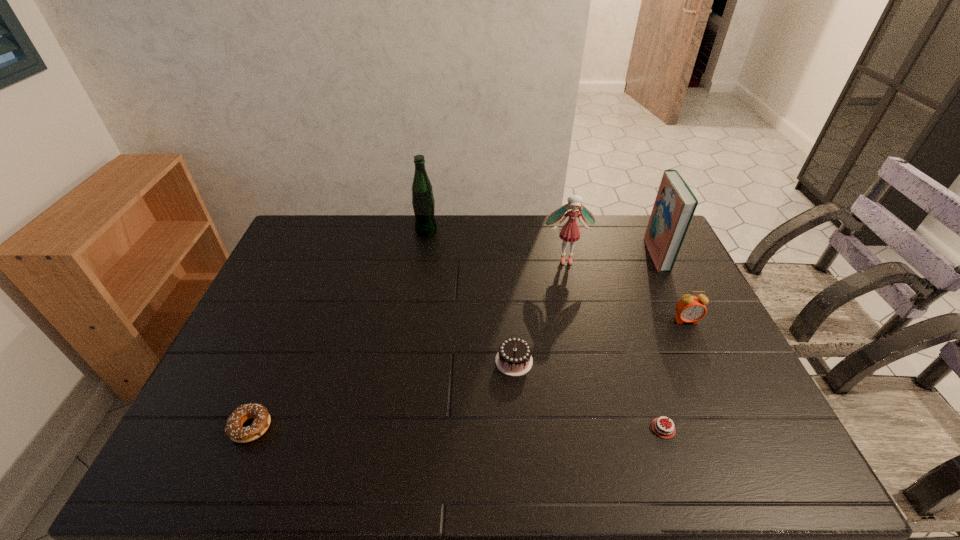
This screenshot has height=540, width=960. What are the coordinates of `beer bottle at the far edge` in the screenshot? It's located at (423, 202).

This screenshot has width=960, height=540. I want to click on hardback book that is positioned at the far edge, so click(675, 204).

What are the coordinates of `doll at the far edge` in the screenshot? It's located at (570, 232).

Identify the location of doughnut present at the near edge. The image size is (960, 540). (233, 429).

Identify the location of chocolate cake positioned at the near edge. Image resolution: width=960 pixels, height=540 pixels. (661, 428).

Where is `object that is positioned at the left edge`? object that is positioned at the left edge is located at coordinates (233, 429).

I want to click on hardback book present at the right edge, so click(675, 204).

I want to click on alarm clock that is at the right edge, so click(690, 308).

I want to click on object positioned at the near left corner, so click(233, 429).

The width and height of the screenshot is (960, 540). I want to click on object located in the far right corner section of the desktop, so click(x=675, y=204).